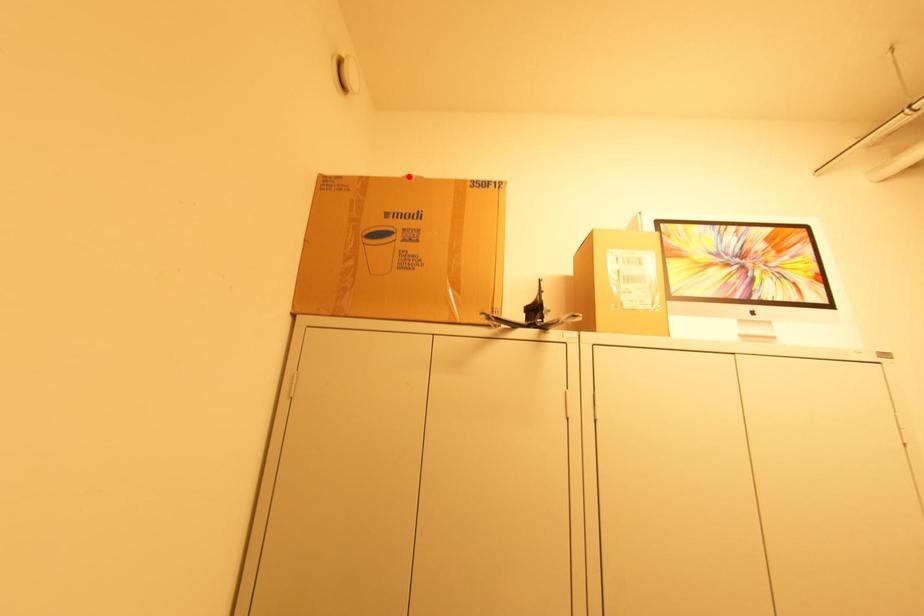
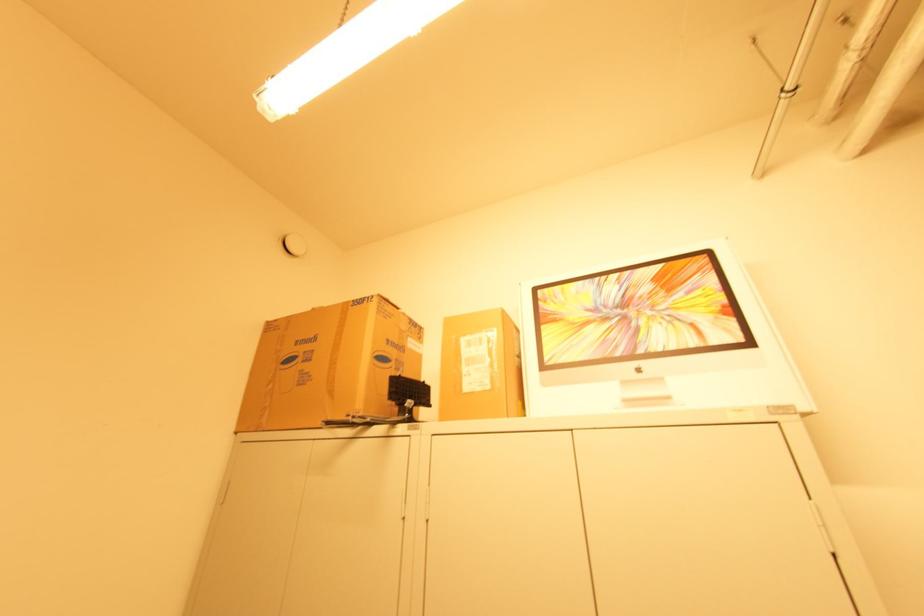
Locate, in the second image, the point that corresponds to the highlighted location in the first image.

(315, 309)